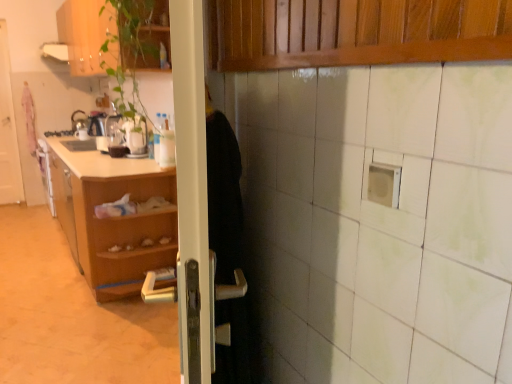
Question: Can you confirm if white glossy exhaust hood at upper left is smaller than white glossy door at left?

Choices:
 (A) yes
 (B) no

Answer: (A)

Question: From the image's perspective, does white glossy exhaust hood at upper left appear lower than white glossy door at left?

Choices:
 (A) yes
 (B) no

Answer: (B)

Question: Is white glossy exhaust hood at upper left further to the viewer compared to white glossy door at left?

Choices:
 (A) no
 (B) yes

Answer: (A)

Question: Is white glossy exhaust hood at upper left positioned far away from white glossy door at left?

Choices:
 (A) no
 (B) yes

Answer: (A)

Question: Does white glossy exhaust hood at upper left have a greater width compared to white glossy door at left?

Choices:
 (A) yes
 (B) no

Answer: (A)

Question: Would you say shiny metallic kettle at left is inside or outside wooden cabinet at upper left?

Choices:
 (A) outside
 (B) inside

Answer: (A)

Question: Is shiny metallic kettle at left bigger or smaller than wooden cabinet at upper left?

Choices:
 (A) big
 (B) small

Answer: (B)

Question: From a real-world perspective, is shiny metallic kettle at left above or below wooden cabinet at upper left?

Choices:
 (A) below
 (B) above

Answer: (A)

Question: Is shiny metallic kettle at left in front of or behind wooden cabinet at upper left in the image?

Choices:
 (A) behind
 (B) front

Answer: (A)

Question: In terms of width, does shiny metallic kettle at left look wider or thinner when compared to white glossy door at left?

Choices:
 (A) thin
 (B) wide

Answer: (B)

Question: Does point (82, 122) appear closer or farther from the camera than point (6, 54)?

Choices:
 (A) farther
 (B) closer

Answer: (B)

Question: In terms of size, does shiny metallic kettle at left appear bigger or smaller than white glossy door at left?

Choices:
 (A) big
 (B) small

Answer: (B)

Question: Is shiny metallic kettle at left situated inside white glossy door at left or outside?

Choices:
 (A) outside
 (B) inside

Answer: (A)

Question: Considering the positions of point (5, 62) and point (154, 1), is point (5, 62) closer or farther from the camera than point (154, 1)?

Choices:
 (A) farther
 (B) closer

Answer: (A)

Question: Relative to wooden cabinet at upper left, is white glossy door at left in front or behind?

Choices:
 (A) front
 (B) behind

Answer: (B)